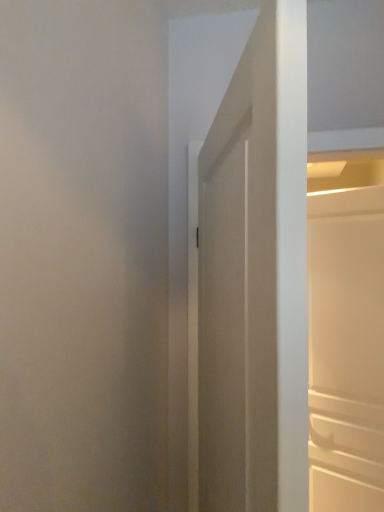
Question: From a real-world perspective, is white matte cabinet at right, which is the first door from back to front, physically located above or below white matte door at center, which is the 2th door in back-to-front order?

Choices:
 (A) above
 (B) below

Answer: (B)

Question: Do you think white matte cabinet at right, the first door from the right, is within white matte door at center, which is the 2th door in back-to-front order, or outside of it?

Choices:
 (A) inside
 (B) outside

Answer: (B)

Question: Looking at their shapes, would you say white matte cabinet at right, the first door from the right, is wider or thinner than white matte door at center, which is the 2th door in back-to-front order?

Choices:
 (A) thin
 (B) wide

Answer: (A)

Question: Based on their positions, is white matte door at center, placed as the first door when sorted from left to right, located to the left or right of white matte cabinet at right, the second door viewed from the left?

Choices:
 (A) left
 (B) right

Answer: (A)

Question: From a real-world perspective, is white matte door at center, which ranks as the second door in right-to-left order, positioned above or below white matte cabinet at right, the second door viewed from the left?

Choices:
 (A) below
 (B) above

Answer: (B)

Question: From the image's perspective, is white matte door at center, placed as the first door when sorted from left to right, located above or below white matte cabinet at right, which is the second door from front to back?

Choices:
 (A) below
 (B) above

Answer: (B)

Question: Looking at their shapes, would you say white matte door at center, placed as the first door when sorted from left to right, is wider or thinner than white matte cabinet at right, the second door viewed from the left?

Choices:
 (A) thin
 (B) wide

Answer: (B)